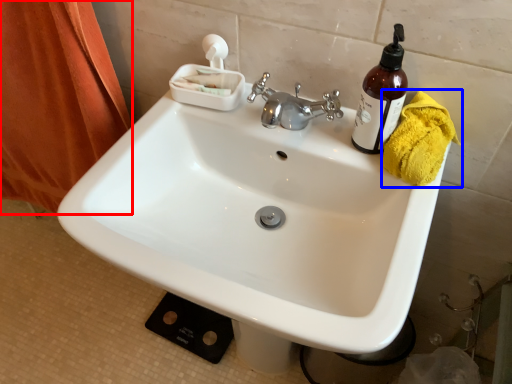
Question: Which of the following is the closest to the observer, shower curtain (highlighted by a red box) or bath towel (highlighted by a blue box)?

Choices:
 (A) shower curtain
 (B) bath towel

Answer: (B)